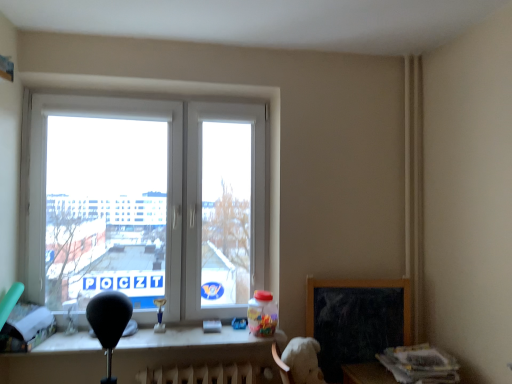
The height and width of the screenshot is (384, 512). What are the coordinates of `empty space that is ontop of white plastic table at lower center` in the screenshot? It's located at (157, 335).